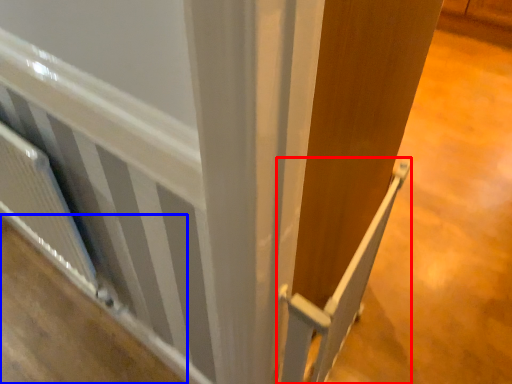
Question: Which point is further to the camera, rail (highlighted by a red box) or plywood (highlighted by a blue box)?

Choices:
 (A) rail
 (B) plywood

Answer: (B)